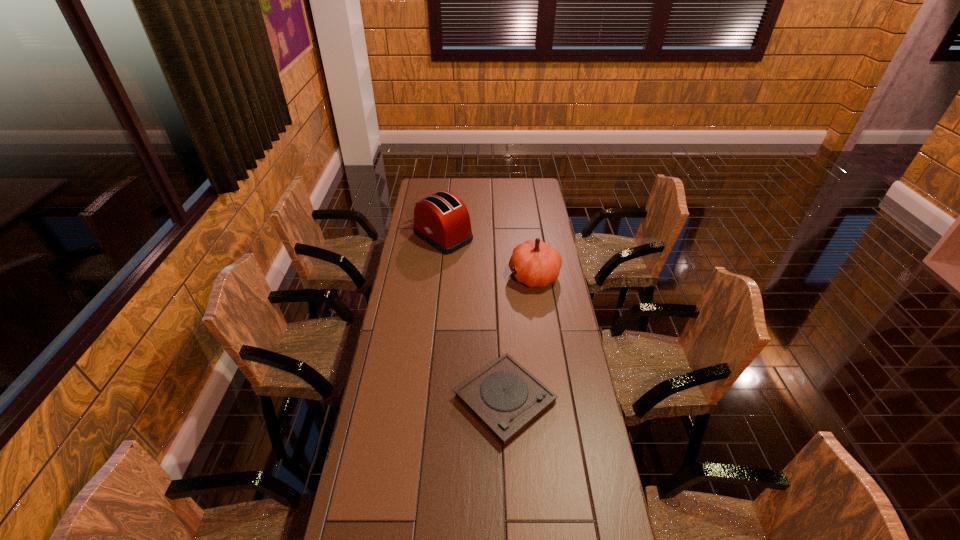
Where is `pumpkin present at the right edge`? pumpkin present at the right edge is located at coordinates (536, 264).

Where is `phonograph record located at the right edge`? Image resolution: width=960 pixels, height=540 pixels. phonograph record located at the right edge is located at coordinates (505, 398).

At what (x,y) coordinates should I click in order to perform the action: click on vacant space at the far edge. Please return your answer as a coordinate pair (x, y). Image resolution: width=960 pixels, height=540 pixels. Looking at the image, I should click on click(x=516, y=198).

What are the coordinates of `free space at the left edge of the desktop` in the screenshot? It's located at (395, 338).

Where is `vacant region at the right edge`? vacant region at the right edge is located at coordinates (555, 292).

You are a GUI agent. You are given a task and a screenshot of the screen. Output one action in this format:
    pyautogui.click(x=<x>, y=<y>)
    Task: Click on the free space between the nearest object and the pumpkin
    The image size is (960, 540).
    Given the screenshot: What is the action you would take?
    pyautogui.click(x=519, y=338)

Find the location of `vacant point located between the second nearest object and the phonograph record`. vacant point located between the second nearest object and the phonograph record is located at coordinates (519, 338).

Locate an element on the screen. free space between the shortest object and the farthest object is located at coordinates (474, 319).

This screenshot has height=540, width=960. Identify the location of free space between the toaster and the nearest object. (474, 319).

Where is `object that can be found as the closest to the toaster`? The height and width of the screenshot is (540, 960). object that can be found as the closest to the toaster is located at coordinates (536, 264).